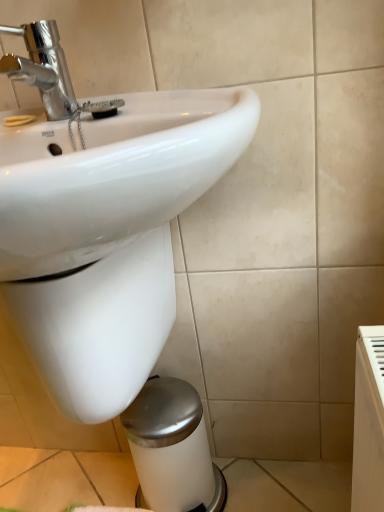
Question: Should I look upward or downward to see white glossy sink at upper left?

Choices:
 (A) down
 (B) up

Answer: (A)